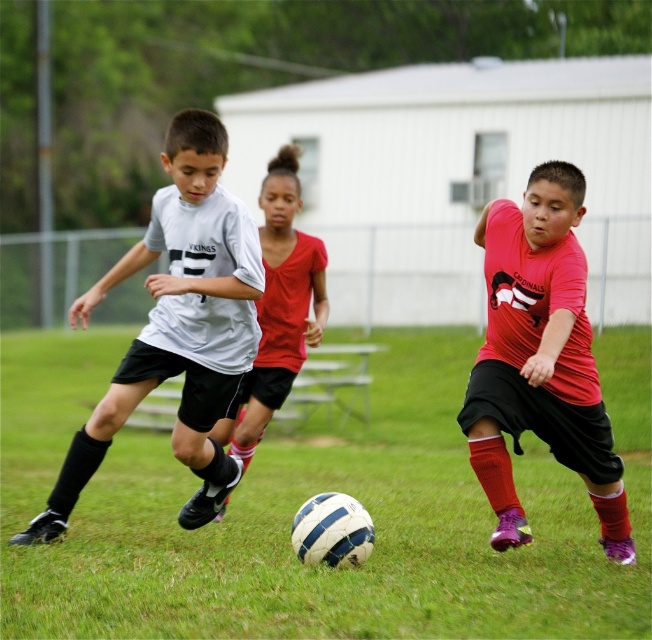
Question: Can you confirm if white textured soccer ball at center is positioned below white matte jersey at center?

Choices:
 (A) no
 (B) yes

Answer: (B)

Question: Which object is closer to the camera taking this photo?

Choices:
 (A) white textured soccer ball at center
 (B) matte red jersey at center
 (C) white matte jersey at center
 (D) matte red shirt at center

Answer: (A)

Question: Can you confirm if white textured soccer ball at center is positioned above matte red jersey at center?

Choices:
 (A) no
 (B) yes

Answer: (A)

Question: Which point is farther to the camera?

Choices:
 (A) matte red shirt at center
 (B) white matte jersey at center

Answer: (A)

Question: Estimate the real-world distances between objects in this image. Which object is farther from the white textured soccer ball at center?

Choices:
 (A) matte red jersey at center
 (B) matte red shirt at center
 (C) white matte jersey at center

Answer: (C)

Question: Is white textured soccer ball at center smaller than white matte jersey at center?

Choices:
 (A) yes
 (B) no

Answer: (B)